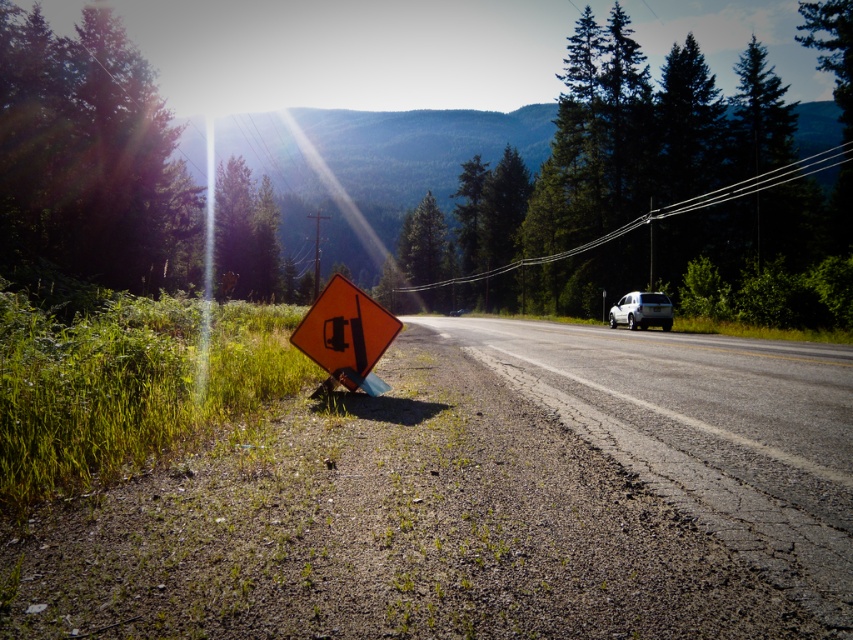
Question: Which point is closer to the camera?

Choices:
 (A) (776, 480)
 (B) (625, 301)
 (C) (601, 241)

Answer: (A)

Question: From the image, what is the correct spatial relationship of asphalt road at center in relation to orange reflective diamond-shaped sign at center-left?

Choices:
 (A) above
 (B) below

Answer: (B)

Question: Which is farther from the metallic wire at upper center?

Choices:
 (A) orange reflective diamond-shaped sign at center-left
 (B) asphalt road at center
 (C) white matte suv at center-right

Answer: (A)

Question: Estimate the real-world distances between objects in this image. Which object is farther from the asphalt road at center?

Choices:
 (A) orange reflective diamond-shaped sign at center-left
 (B) metallic wire at upper center

Answer: (B)

Question: Is asphalt road at center to the right of white matte suv at center-right from the viewer's perspective?

Choices:
 (A) yes
 (B) no

Answer: (B)

Question: Does asphalt road at center have a lesser width compared to orange reflective diamond-shaped sign at center-left?

Choices:
 (A) no
 (B) yes

Answer: (A)